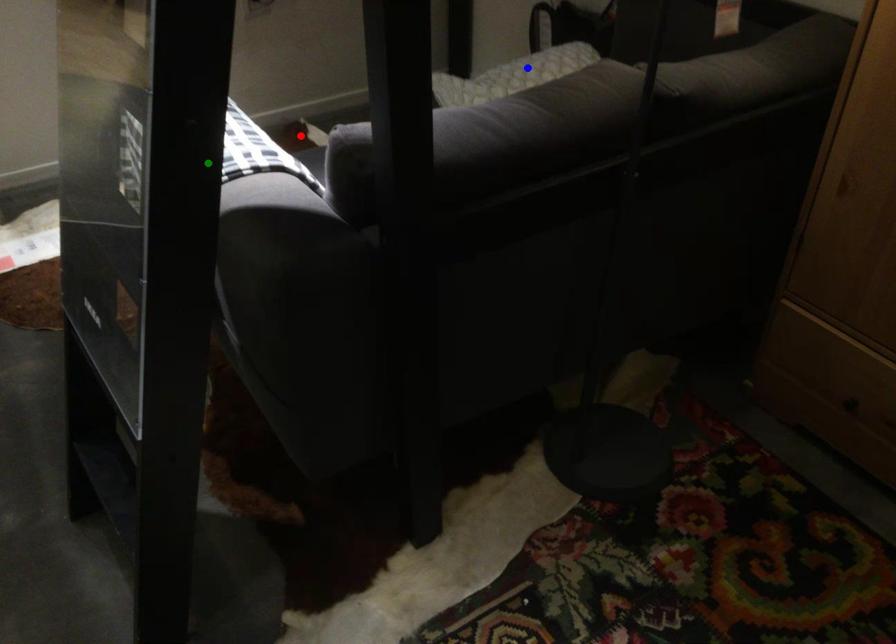
Order these from nearest to farthest:
- blue point
- green point
- red point

green point → blue point → red point